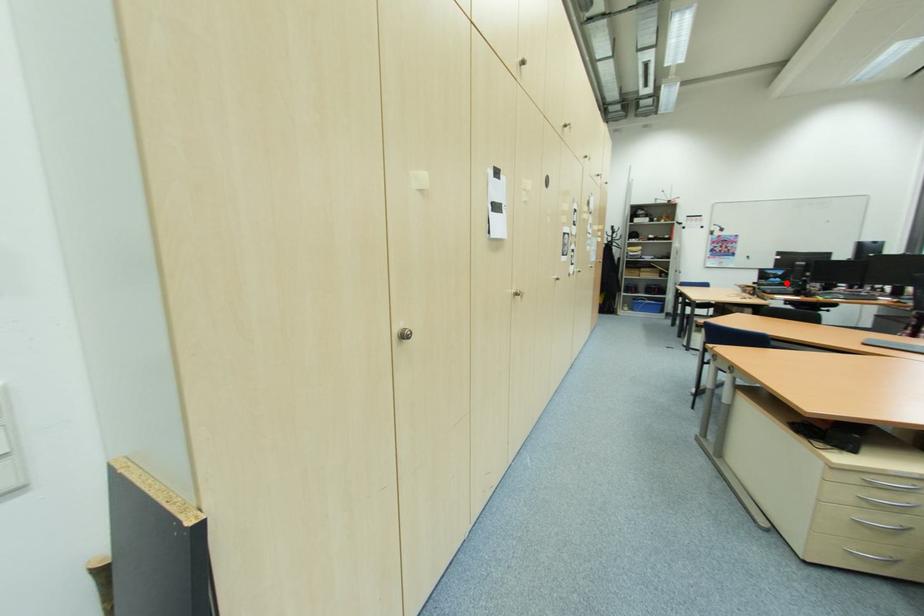
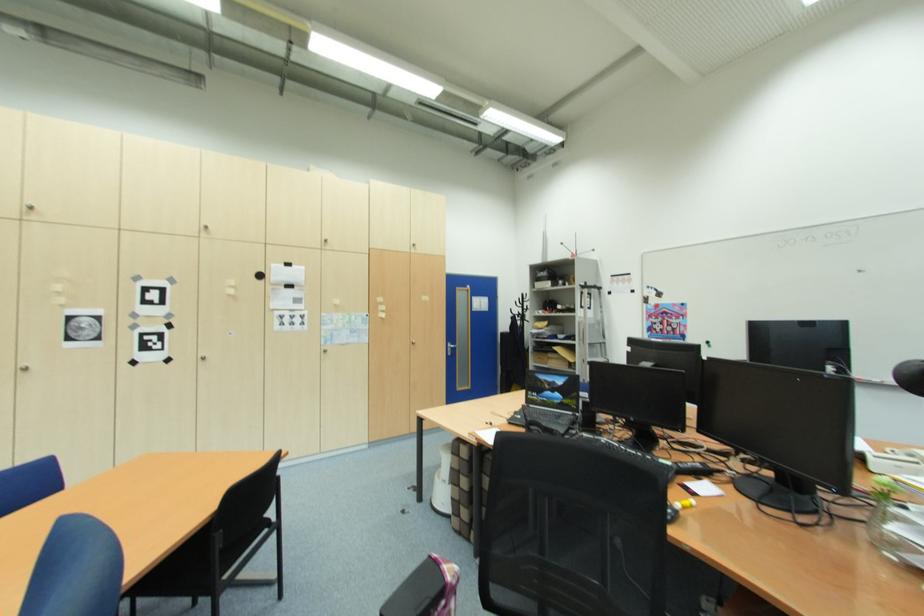
Locate, in the second image, the point that corresponds to the highlighted location in the first image.

(569, 402)